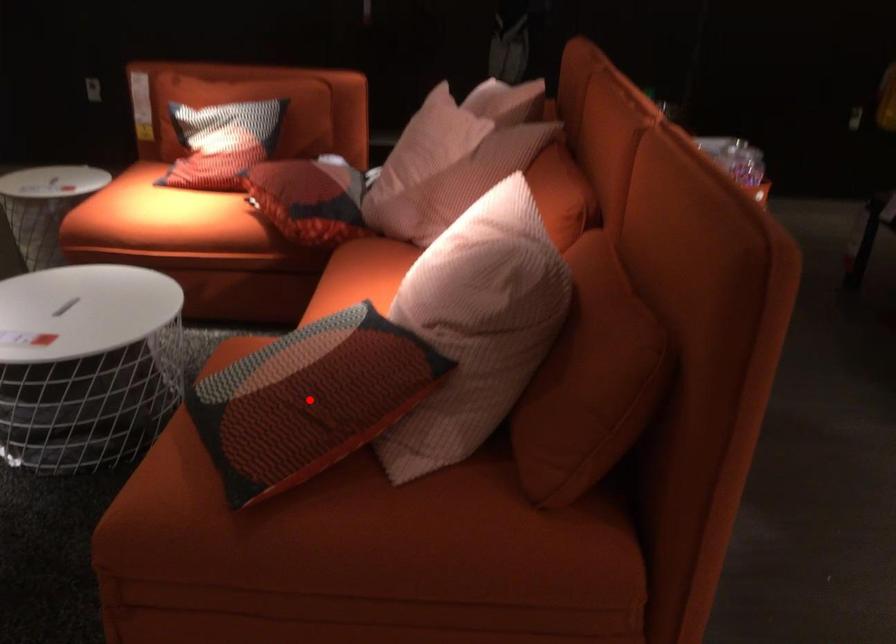
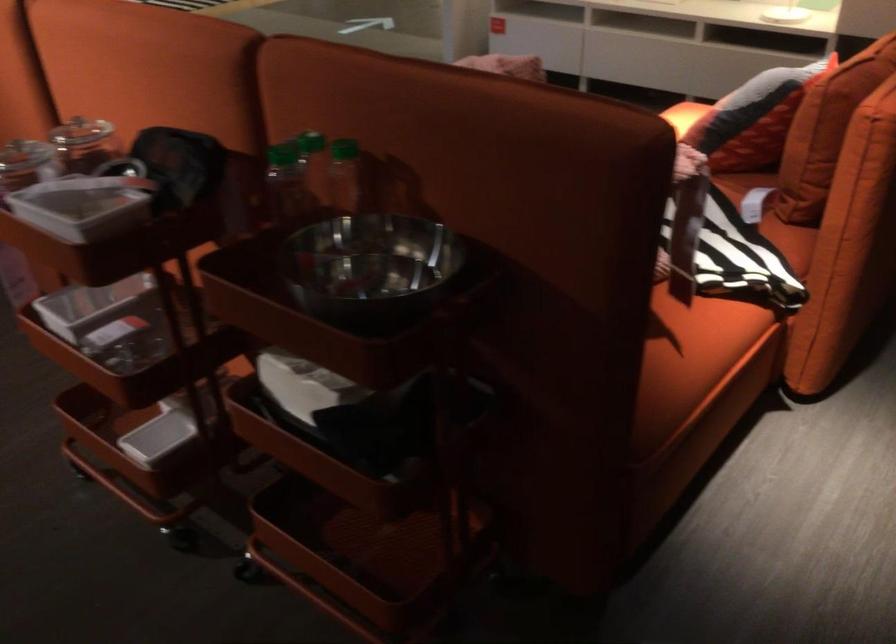
Question: I am providing you with two images of the same scene from different viewpoints. A red point is marked on the first image. Is the red point's position out of view in image 2?

Choices:
 (A) Yes
 (B) No

Answer: (A)